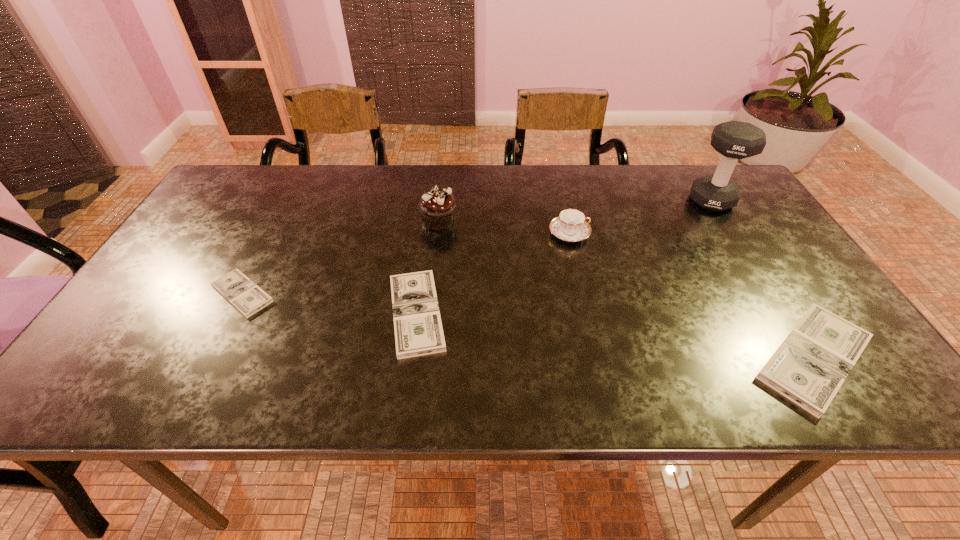
You are a GUI agent. You are given a task and a screenshot of the screen. Output one action in this format:
    pyautogui.click(x=<x>, y=<y>)
    Task: Click on the vacant area that lies between the dumbbell and the teacup
    
    Given the screenshot: What is the action you would take?
    pyautogui.click(x=640, y=217)

Locate an element on the screen. The width and height of the screenshot is (960, 540). free space between the second shortest dollar and the leftmost dollar is located at coordinates (329, 303).

I want to click on vacant space that's between the rightmost dollar and the second shortest dollar, so click(615, 335).

Find the location of `unoccupied position between the rightmost dollar and the dumbbell`. unoccupied position between the rightmost dollar and the dumbbell is located at coordinates (762, 279).

Locate an element on the screen. The height and width of the screenshot is (540, 960). free space between the rightmost dollar and the second tallest object is located at coordinates (626, 290).

I want to click on object identified as the fourth closest to the cupcake, so click(x=809, y=367).

Find the location of a particular element. The image size is (960, 540). object that can be found as the third closest to the leftmost dollar is located at coordinates (571, 226).

What are the coordinates of `dollar identified as the second closest to the rightmost dollar` in the screenshot? It's located at (242, 293).

The height and width of the screenshot is (540, 960). Find the location of `dollar that is the second closest one to the leftmost object`. dollar that is the second closest one to the leftmost object is located at coordinates (809, 367).

Where is `blank space that satisfies the following two spatial constraints: 1. on the back side of the fifth tallest object; 2. on the right side of the dumbbell`? The width and height of the screenshot is (960, 540). blank space that satisfies the following two spatial constraints: 1. on the back side of the fifth tallest object; 2. on the right side of the dumbbell is located at coordinates (432, 200).